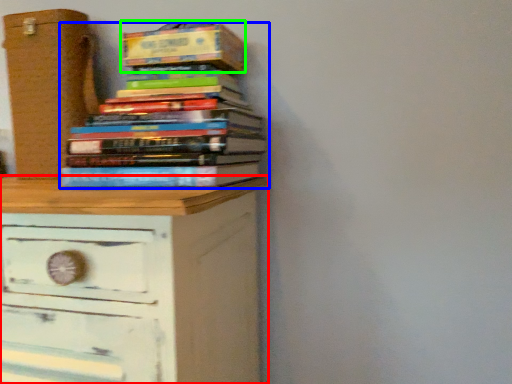
Question: Considering the real-world distances, which object is closest to chest of drawers (highlighted by a red box)? book (highlighted by a blue box) or paperback book (highlighted by a green box).

Choices:
 (A) book
 (B) paperback book

Answer: (A)